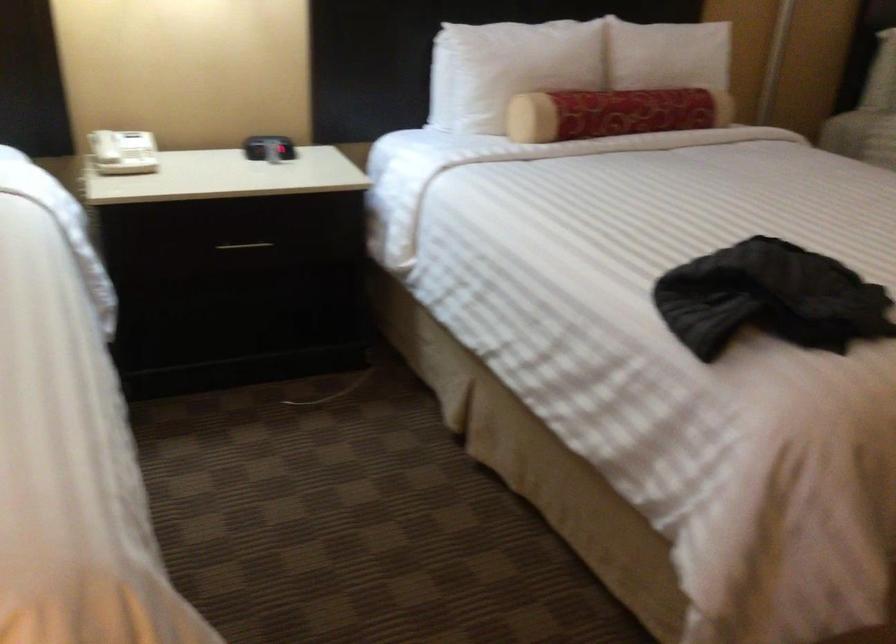
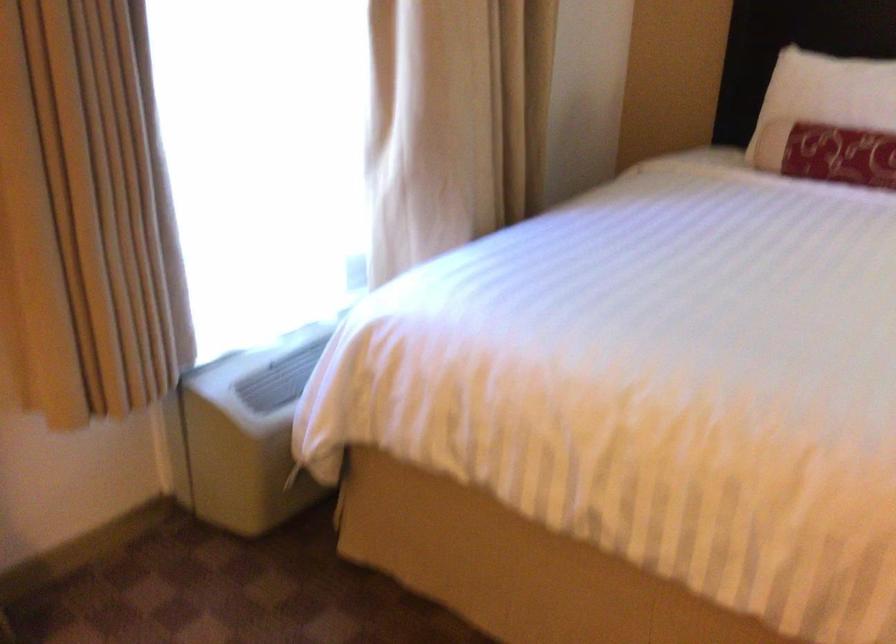
Question: The images are taken continuously from a first-person perspective. In which direction is your viewpoint rotating?

Choices:
 (A) Left
 (B) Right
 (C) Up
 (D) Down

Answer: (A)